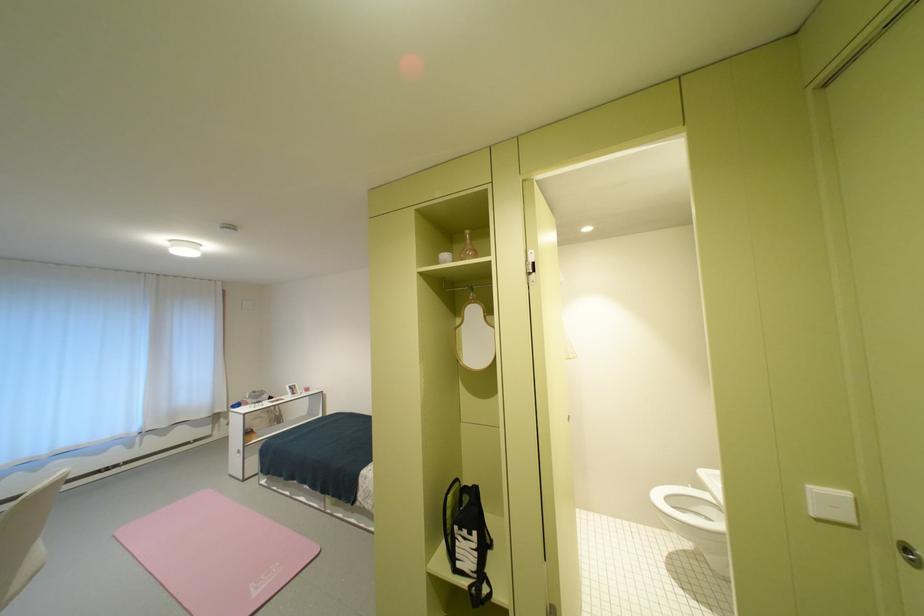
This screenshot has height=616, width=924. I want to click on white light switch, so click(x=831, y=505).